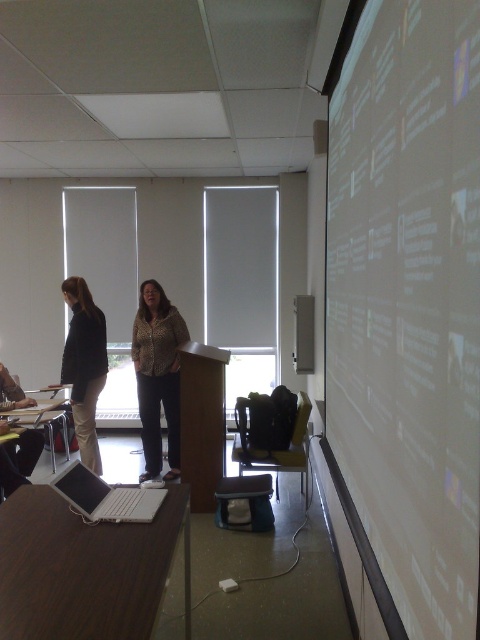
You are a student entering the classroom and need to locate the leopard print jacket at center. Is the white matte projector screen at right blocking your view of the jacket?

The white matte projector screen at right is in front of the leopard print jacket at center, so yes, the screen is blocking your view of the jacket.

You are standing at the entrance of the classroom and want to move towards the point labeled as point (152, 324). However, there is an obstacle at point (82, 436). Will you be able to reach your destination without going around the obstacle?

Since point (152, 324) is behind point (82, 436), you will need to go around the obstacle at point (82, 436) to reach your destination.

You are a student entering the classroom and see the leopard print jacket at center and the matte black jacket at left. Which jacket is closer to the floor?

The leopard print jacket at center is closer to the floor because it is positioned below the matte black jacket at left.